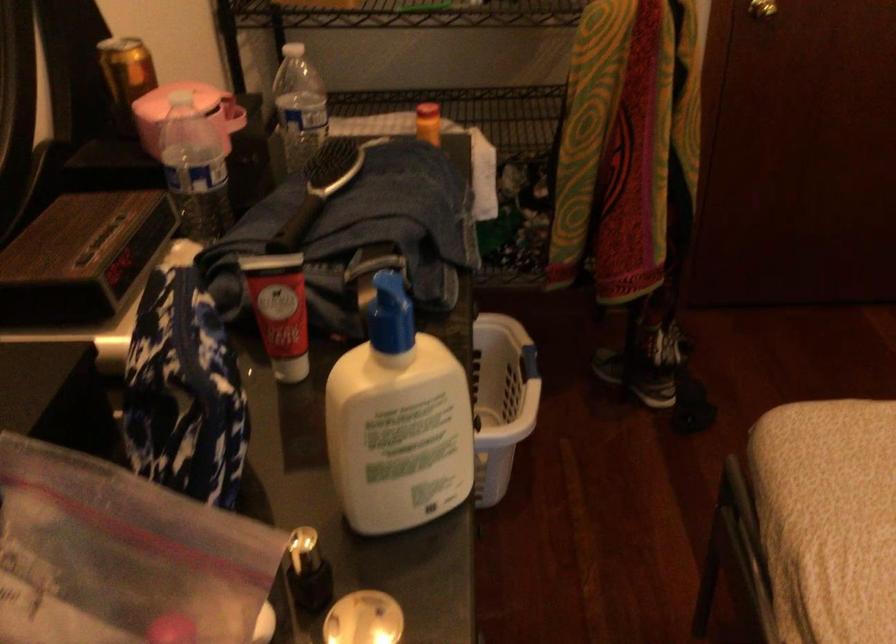
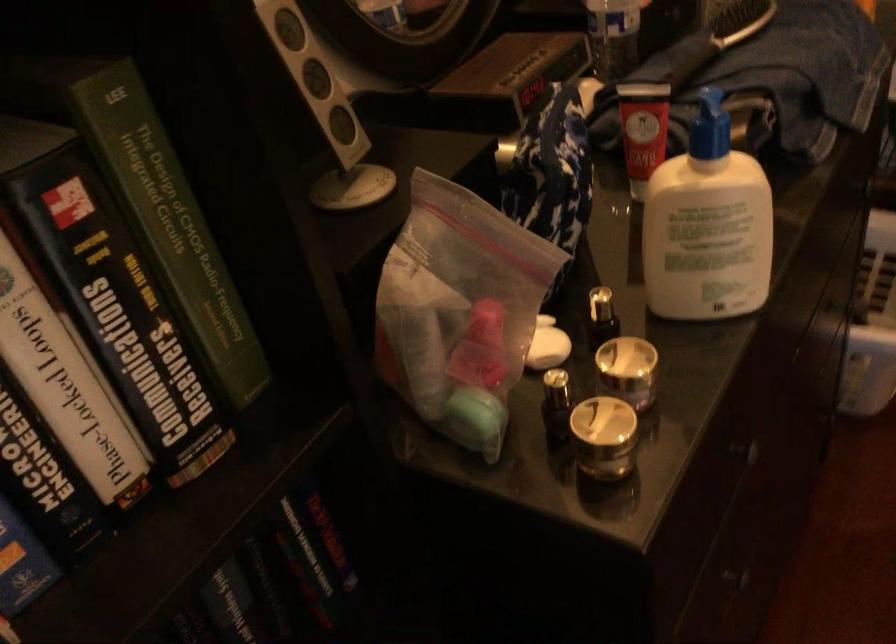
Locate, in the second image, the point that corresponds to [394,327] in the first image.

(709, 126)